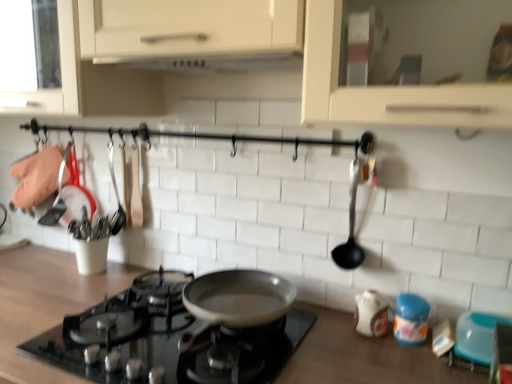
Where is `free spot to the left of blue plastic container at lower right, marked as the second appliance in a right-to-left arrangement`? free spot to the left of blue plastic container at lower right, marked as the second appliance in a right-to-left arrangement is located at coordinates (344, 339).